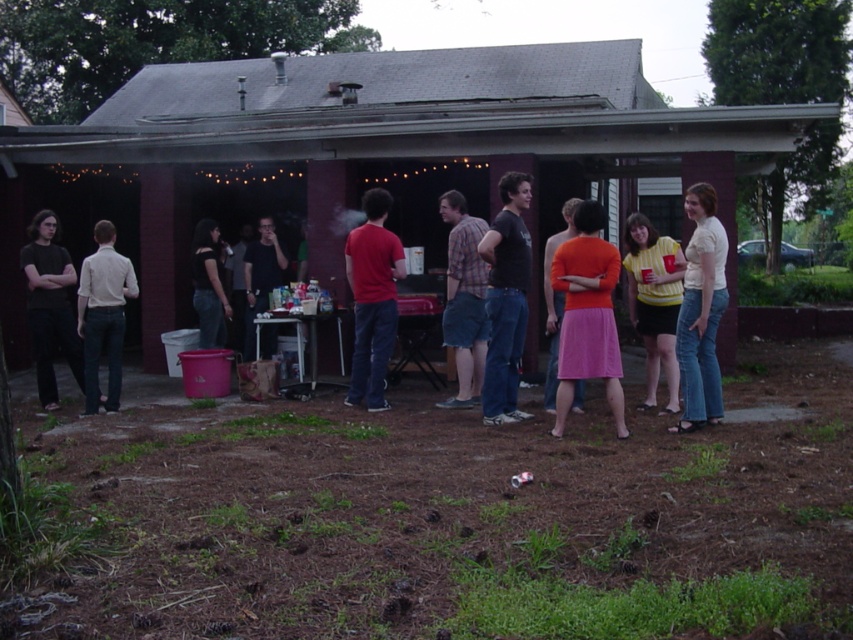
Is brown wooden hut at center thinner than matte red shirt at center?

In fact, brown wooden hut at center might be wider than matte red shirt at center.

Who is positioned more to the right, brown wooden hut at center or matte red shirt at center?

matte red shirt at center is more to the right.

Find the location of a particular element. brown wooden hut at center is located at coordinates (358, 152).

This screenshot has height=640, width=853. Identify the location of brown wooden hut at center. (358, 152).

Can you confirm if brown wooden hut at center is taller than orange matte dress at center?

Yes, brown wooden hut at center is taller than orange matte dress at center.

Does brown wooden hut at center have a larger size compared to orange matte dress at center?

Correct, brown wooden hut at center is larger in size than orange matte dress at center.

Who is more forward, (334, 288) or (547, 246)?

Point (547, 246) is more forward.

This screenshot has width=853, height=640. Identify the location of brown wooden hut at center. (358, 152).

Between point (714, 340) and point (126, 280), which one is positioned behind?

Point (126, 280)

Is point (704, 285) in front of point (102, 243)?

Yes.

Image resolution: width=853 pixels, height=640 pixels. I want to click on white cotton shirt at center-right, so click(x=701, y=312).